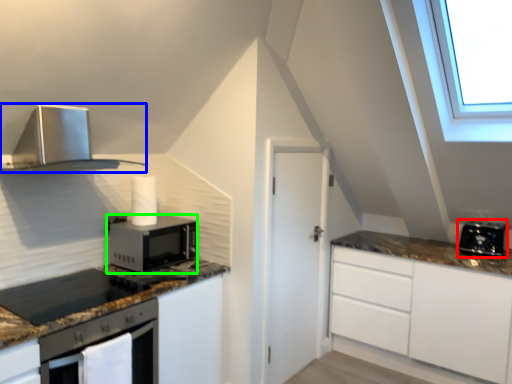
Question: Considering the real-world distances, which object is farthest from toaster (highlighted by a red box)? home appliance (highlighted by a blue box) or microwave oven (highlighted by a green box)?

Choices:
 (A) home appliance
 (B) microwave oven

Answer: (A)